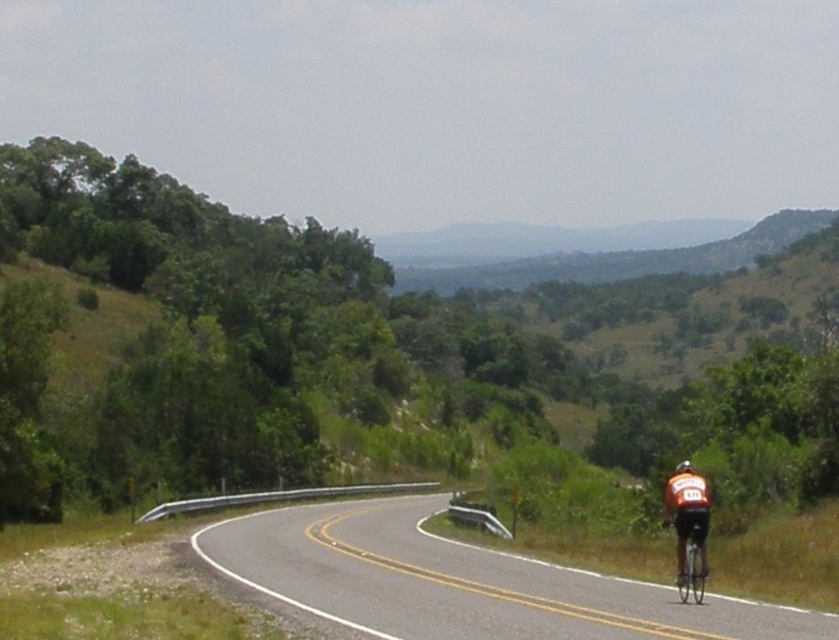
Who is more distant from viewer, (678, 532) or (692, 563)?

Point (692, 563)

Between orange fabric cyclist at lower right and shiny silver bicycle at right, which one is positioned higher?

Positioned higher is orange fabric cyclist at lower right.

Locate an element on the screen. This screenshot has height=640, width=839. orange fabric cyclist at lower right is located at coordinates (686, 522).

Find the location of `orange fabric cyclist at lower right`. orange fabric cyclist at lower right is located at coordinates (686, 522).

Between point (348, 611) and point (689, 461), which one is positioned in front?

Positioned in front is point (348, 611).

Who is shorter, asphalt road at center or shiny orange helmet at right?

Standing shorter between the two is shiny orange helmet at right.

Locate an element on the screen. The width and height of the screenshot is (839, 640). asphalt road at center is located at coordinates (461, 580).

The height and width of the screenshot is (640, 839). Describe the element at coordinates (461, 580) in the screenshot. I see `asphalt road at center` at that location.

Between point (237, 525) and point (684, 504), which one is positioned behind?

The point (237, 525) is behind.

Find the location of a particular element. This screenshot has height=640, width=839. asphalt road at center is located at coordinates (461, 580).